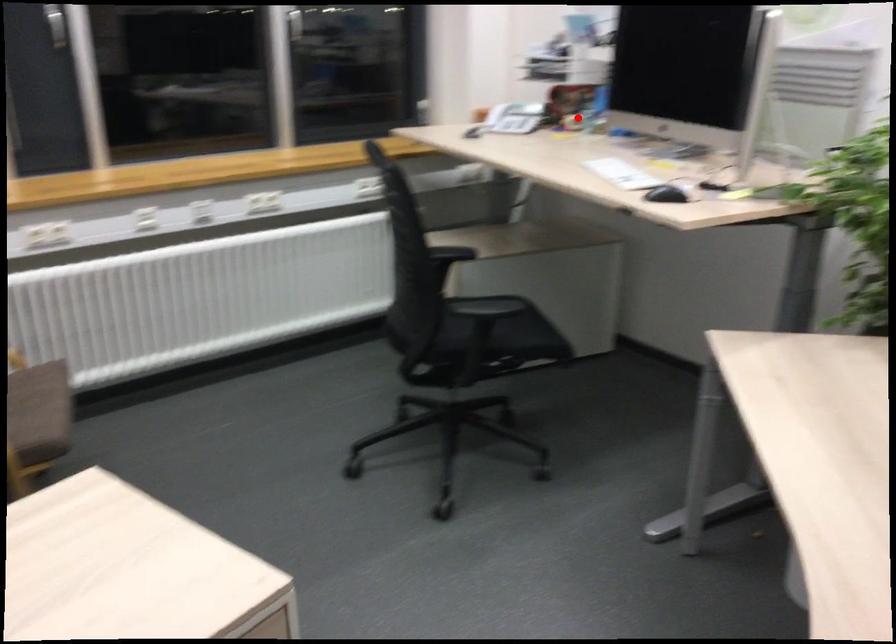
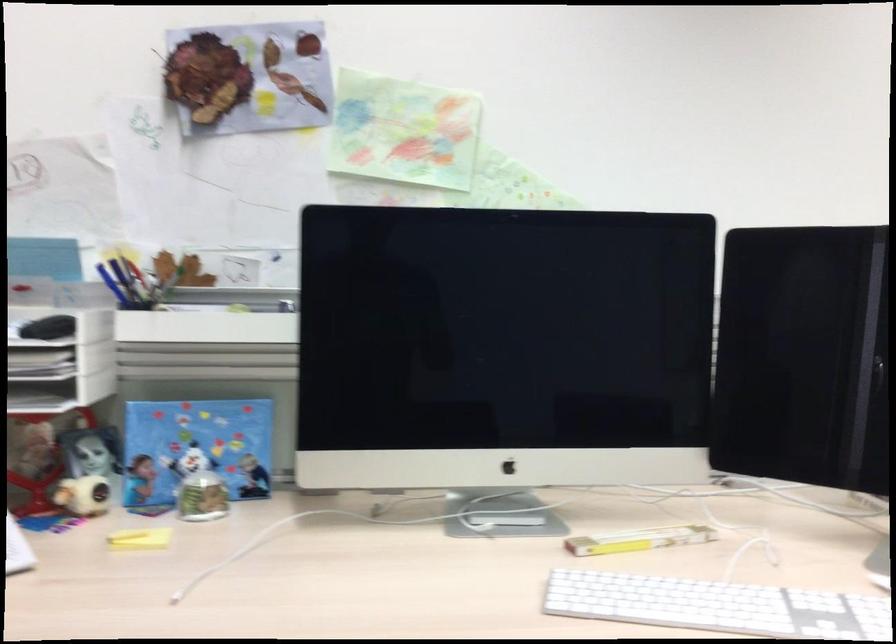
Question: I am providing you with two images of the same scene from different viewpoints. Given a red point in image1, look at the same physical point in image2. Is it:

Choices:
 (A) Closer to the viewpoint
 (B) Farther from the viewpoint

Answer: (A)